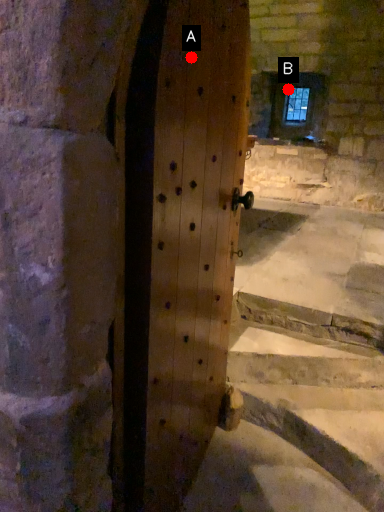
Question: Two points are circled on the image, labeled by A and B beside each circle. Among these points, which one is nearest to the camera?

Choices:
 (A) A is closer
 (B) B is closer

Answer: (A)